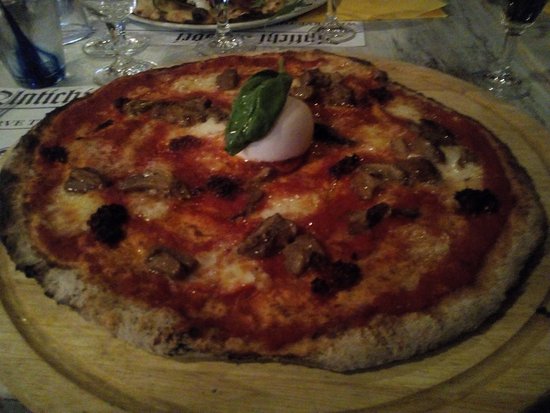
The width and height of the screenshot is (550, 413). I want to click on newspaper, so click(x=166, y=37).